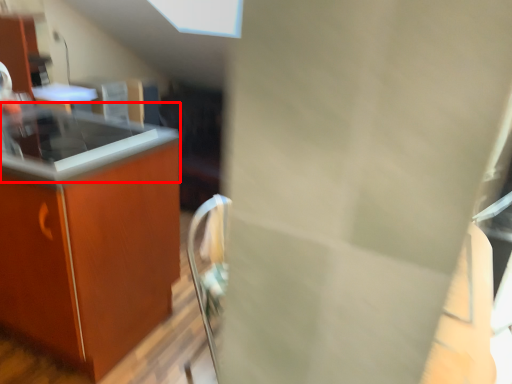
Question: From the image's perspective, where is countertop (annotated by the red box) located relative to countertop?

Choices:
 (A) below
 (B) above

Answer: (B)